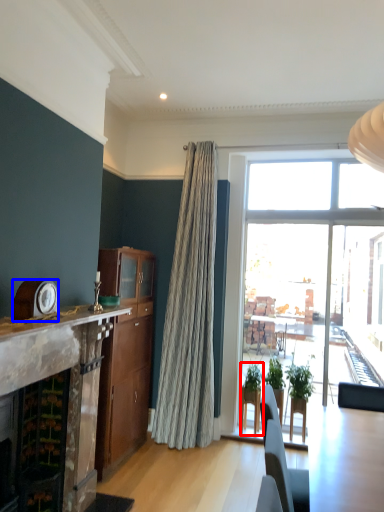
Question: Among these objects, which one is nearest to the camera, houseplant (highlighted by a red box) or clock (highlighted by a blue box)?

Choices:
 (A) houseplant
 (B) clock

Answer: (B)